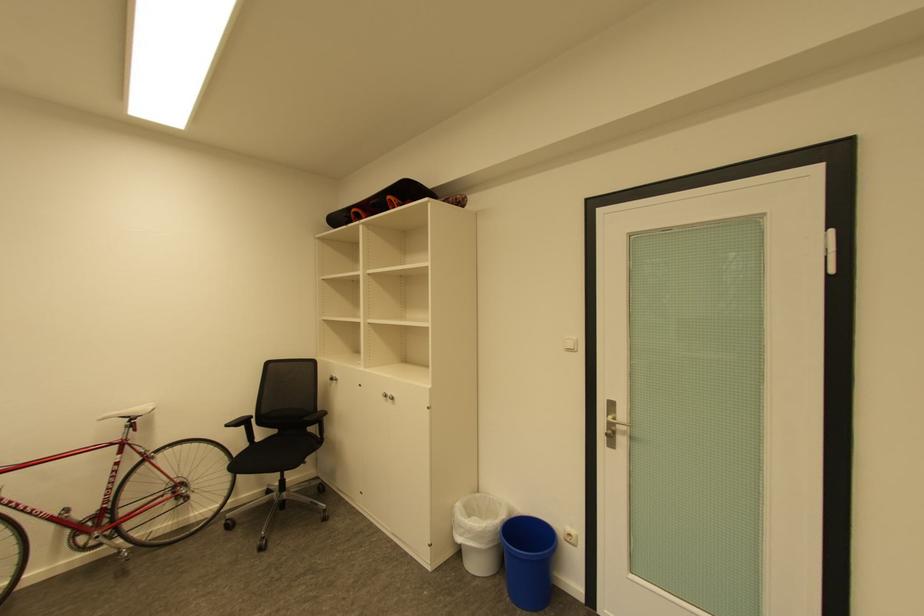
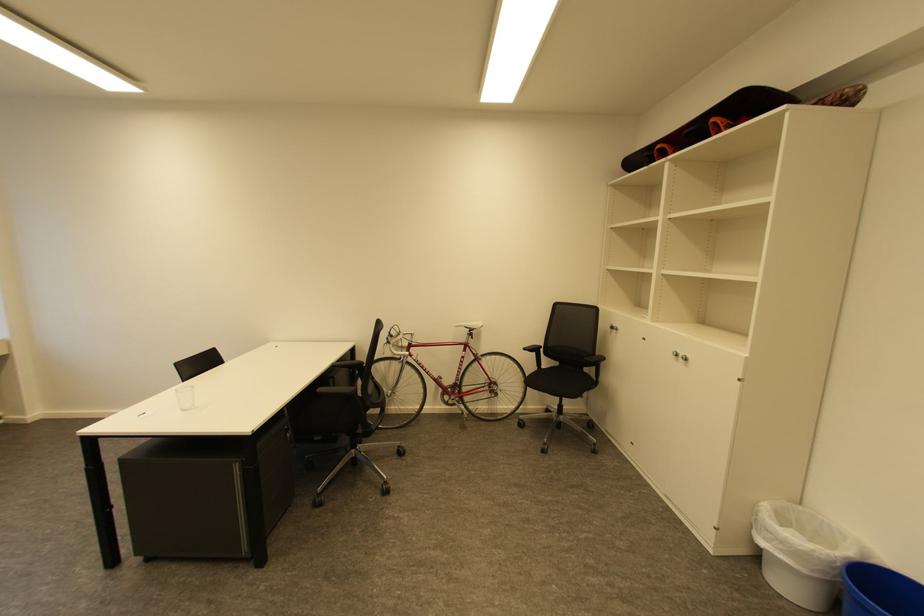
Question: The first image is from the beginning of the video and the second image is from the end. How did the camera likely rotate when shooting the video?

Choices:
 (A) Left
 (B) Right
 (C) Up
 (D) Down

Answer: (A)